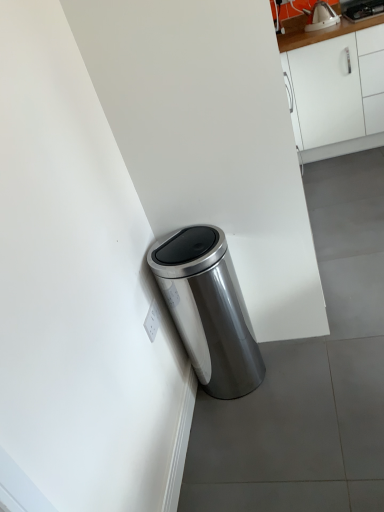
Identify the location of white plastic electric outlet at lower left. (152, 321).

Identify the location of white plastic electric outlet at lower left. (152, 321).

Does satin silver trash can at lower left turn towards white plastic electric outlet at lower left?

No, satin silver trash can at lower left is not facing towards white plastic electric outlet at lower left.

How different are the orientations of satin silver trash can at lower left and white plastic electric outlet at lower left in degrees?

They differ by 0.00702 degrees in their facing directions.

Does point (194, 233) lie in front of point (151, 334)?

No, (194, 233) is further to viewer.

Considering the sizes of objects satin silver trash can at lower left and white plastic electric outlet at lower left in the image provided, who is smaller, satin silver trash can at lower left or white plastic electric outlet at lower left?

white plastic electric outlet at lower left.

Is point (340, 120) positioned in front of point (152, 320)?

No.

Is white matte cabinet at upper right further to camera compared to white plastic electric outlet at lower left?

Yes, it is behind white plastic electric outlet at lower left.

This screenshot has width=384, height=512. In the image, there is a white plastic electric outlet at lower left. Identify the location of cabinetry above it (from the image's perspective). (334, 88).

How many degrees apart are the facing directions of white matte cabinet at upper right and white plastic electric outlet at lower left?

90 degrees separate the facing orientations of white matte cabinet at upper right and white plastic electric outlet at lower left.

Is metallic silver kettle at upper right turned away from white matte cabinet at upper right?

Yes.

Can you confirm if metallic silver kettle at upper right is positioned to the right of white matte cabinet at upper right?

Yes, metallic silver kettle at upper right is to the right of white matte cabinet at upper right.

Can you confirm if metallic silver kettle at upper right is bigger than white matte cabinet at upper right?

No.

How much distance is there between metallic silver kettle at upper right and white plastic electric outlet at lower left?

metallic silver kettle at upper right and white plastic electric outlet at lower left are 8.92 feet apart.

Can you confirm if metallic silver kettle at upper right is positioned to the left of white plastic electric outlet at lower left?

In fact, metallic silver kettle at upper right is to the right of white plastic electric outlet at lower left.

Considering the sizes of metallic silver kettle at upper right and white plastic electric outlet at lower left in the image, is metallic silver kettle at upper right taller or shorter than white plastic electric outlet at lower left?

metallic silver kettle at upper right is taller than white plastic electric outlet at lower left.

From a real-world perspective, relative to white plastic electric outlet at lower left, is metallic silver kettle at upper right vertically above or below?

metallic silver kettle at upper right is above white plastic electric outlet at lower left.

Between metallic silver kettle at upper right and satin silver trash can at lower left, which one is positioned behind?

metallic silver kettle at upper right.

Does point (364, 14) lie behind point (225, 337)?

Yes, it is.

Which object is wider, metallic silver kettle at upper right or satin silver trash can at lower left?

Wider between the two is metallic silver kettle at upper right.

Does white plastic electric outlet at lower left have a smaller size compared to metallic silver kettle at upper right?

Yes, white plastic electric outlet at lower left is smaller than metallic silver kettle at upper right.

You are a GUI agent. You are given a task and a screenshot of the screen. Output one action in this format:
    pyautogui.click(x=<x>, y=<y>)
    Task: Click on the appliance above the white plastic electric outlet at lower left (from a real-world perspective)
    The image size is (384, 512).
    Given the screenshot: What is the action you would take?
    pyautogui.click(x=362, y=9)

From the image's perspective, is white plastic electric outlet at lower left above or below metallic silver kettle at upper right?

white plastic electric outlet at lower left is below metallic silver kettle at upper right.

Which object is further away from the camera taking this photo, satin silver trash can at lower left or white matte cabinet at upper right?

white matte cabinet at upper right.

Does point (226, 298) appear closer or farther from the camera than point (320, 90)?

Clearly, point (226, 298) is closer to the camera than point (320, 90).

Considering the sizes of satin silver trash can at lower left and white matte cabinet at upper right in the image, is satin silver trash can at lower left wider or thinner than white matte cabinet at upper right?

Considering their sizes, satin silver trash can at lower left looks slimmer than white matte cabinet at upper right.

In the scene shown: Between satin silver trash can at lower left and white matte cabinet at upper right, which one has less height?

satin silver trash can at lower left is shorter.

The image size is (384, 512). Find the location of `waste container on the right of white plastic electric outlet at lower left`. waste container on the right of white plastic electric outlet at lower left is located at coordinates (208, 309).

Where is `cabinetry above the white plastic electric outlet at lower left (from a real-world perspective)`? This screenshot has height=512, width=384. cabinetry above the white plastic electric outlet at lower left (from a real-world perspective) is located at coordinates (334, 88).

Estimate the real-world distances between objects in this image. Which object is further from metallic silver kettle at upper right, white plastic electric outlet at lower left or white matte cabinet at upper right?

white plastic electric outlet at lower left is further to metallic silver kettle at upper right.

Based on their spatial positions, is white plastic electric outlet at lower left or satin silver trash can at lower left closer to white matte cabinet at upper right?

satin silver trash can at lower left.

Looking at the image, which one is located further to white matte cabinet at upper right, satin silver trash can at lower left or white plastic electric outlet at lower left?

Based on the image, white plastic electric outlet at lower left appears to be further to white matte cabinet at upper right.

Looking at this image, considering their positions, is white plastic electric outlet at lower left positioned closer to satin silver trash can at lower left than white matte cabinet at upper right?

white plastic electric outlet at lower left lies closer to satin silver trash can at lower left than the other object.

Considering their positions, is white plastic electric outlet at lower left positioned further to metallic silver kettle at upper right than satin silver trash can at lower left?

Based on the image, white plastic electric outlet at lower left appears to be further to metallic silver kettle at upper right.

When comparing their distances from white matte cabinet at upper right, does metallic silver kettle at upper right or satin silver trash can at lower left seem closer?

The object closer to white matte cabinet at upper right is metallic silver kettle at upper right.

Looking at the image, which one is located further to metallic silver kettle at upper right, white matte cabinet at upper right or satin silver trash can at lower left?

Based on the image, satin silver trash can at lower left appears to be further to metallic silver kettle at upper right.

Based on their spatial positions, is satin silver trash can at lower left or metallic silver kettle at upper right further from white matte cabinet at upper right?

Among the two, satin silver trash can at lower left is located further to white matte cabinet at upper right.

You are a GUI agent. You are given a task and a screenshot of the screen. Output one action in this format:
    pyautogui.click(x=<x>, y=<y>)
    Task: Click on the waste container that lies between metallic silver kettle at upper right and white plastic electric outlet at lower left from top to bottom
    
    Given the screenshot: What is the action you would take?
    pyautogui.click(x=208, y=309)

Where is `cabinetry that lies between metallic silver kettle at upper right and white plastic electric outlet at lower left from top to bottom`? This screenshot has height=512, width=384. cabinetry that lies between metallic silver kettle at upper right and white plastic electric outlet at lower left from top to bottom is located at coordinates (334, 88).

Identify the location of cabinetry between metallic silver kettle at upper right and satin silver trash can at lower left in the up-down direction. Image resolution: width=384 pixels, height=512 pixels. (334, 88).

I want to click on waste container between white matte cabinet at upper right and white plastic electric outlet at lower left vertically, so click(x=208, y=309).